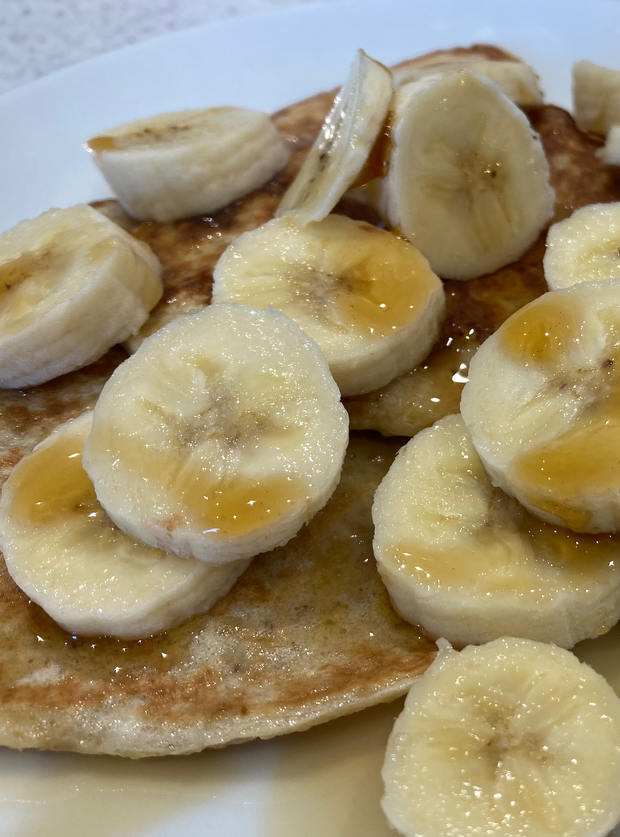
The width and height of the screenshot is (620, 837). Identify the location of plate rim. (100, 57).